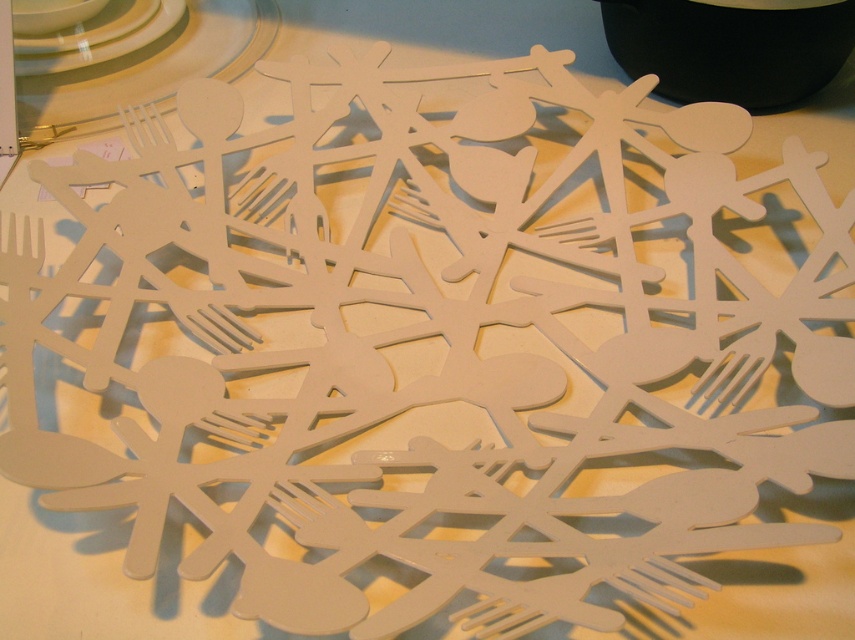
Question: Is black matte bottle at upper right below white glossy plate at upper left?

Choices:
 (A) yes
 (B) no

Answer: (A)

Question: Among these objects, which one is farthest from the camera?

Choices:
 (A) black matte bottle at upper right
 (B) matte white plastic fork at upper left
 (C) white glossy plate at upper left

Answer: (C)

Question: Which of the following is the farthest from the observer?

Choices:
 (A) (811, 4)
 (B) (134, 42)

Answer: (B)

Question: Which point appears closest to the camera in this image?

Choices:
 (A) (736, 92)
 (B) (16, 74)

Answer: (A)

Question: From the image, what is the correct spatial relationship of black matte bottle at upper right in relation to white glossy plate at upper left?

Choices:
 (A) below
 (B) above

Answer: (A)

Question: Is black matte bottle at upper right above white glossy plate at upper left?

Choices:
 (A) no
 (B) yes

Answer: (A)